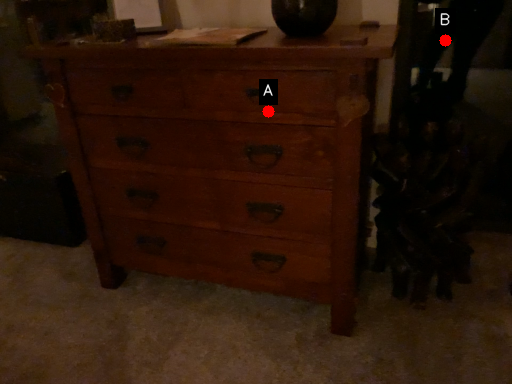
Question: Two points are circled on the image, labeled by A and B beside each circle. Which point appears farthest from the camera in this image?

Choices:
 (A) A is further
 (B) B is further

Answer: (B)